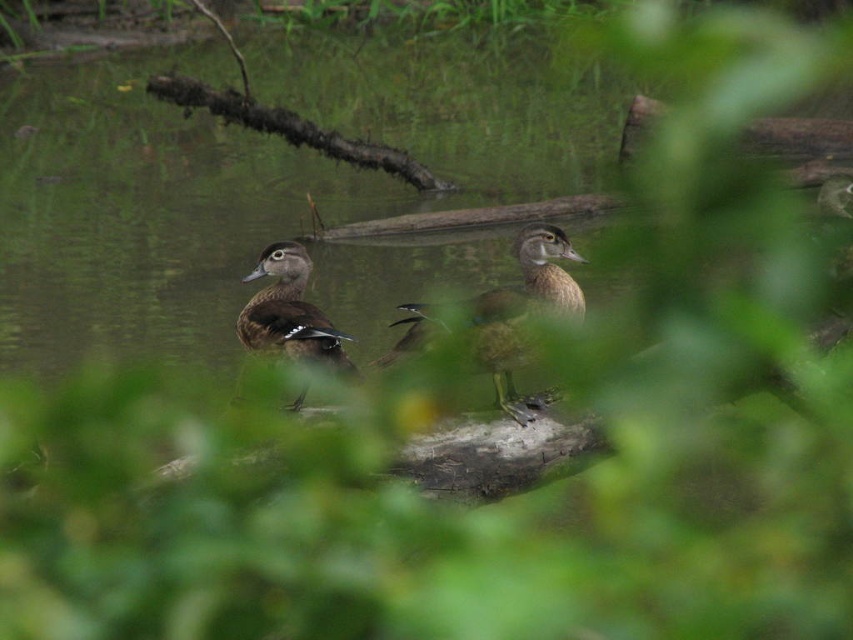
Is point (563, 312) more distant than point (256, 332)?

No, (563, 312) is in front of (256, 332).

The width and height of the screenshot is (853, 640). Identify the location of brown glossy duck at center. (521, 310).